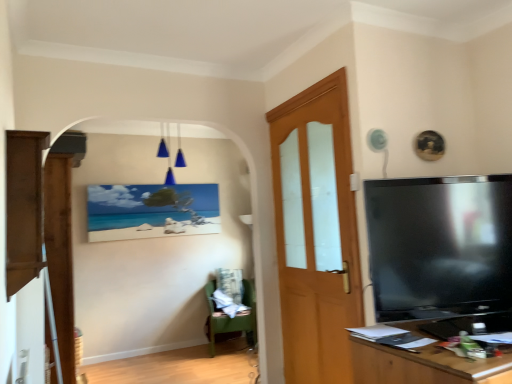
Question: From the image's perspective, would you say black glossy tv at right is positioned over brown wood cabinet at left?

Choices:
 (A) yes
 (B) no

Answer: (B)

Question: Is black glossy tv at right positioned with its back to brown wood cabinet at left?

Choices:
 (A) no
 (B) yes

Answer: (A)

Question: Is the depth of black glossy tv at right less than that of brown wood cabinet at left?

Choices:
 (A) yes
 (B) no

Answer: (B)

Question: Considering the relative sizes of black glossy tv at right and brown wood cabinet at left in the image provided, is black glossy tv at right bigger than brown wood cabinet at left?

Choices:
 (A) no
 (B) yes

Answer: (B)

Question: Can you confirm if black glossy tv at right is thinner than brown wood cabinet at left?

Choices:
 (A) yes
 (B) no

Answer: (B)

Question: Considering the relative positions of black glossy tv at right and brown wood cabinet at left in the image provided, is black glossy tv at right to the right of brown wood cabinet at left from the viewer's perspective?

Choices:
 (A) no
 (B) yes

Answer: (B)

Question: Is matte canvas painting at center not inside black glossy tv at right?

Choices:
 (A) no
 (B) yes

Answer: (B)

Question: Is matte canvas painting at center far from black glossy tv at right?

Choices:
 (A) no
 (B) yes

Answer: (B)

Question: Does matte canvas painting at center have a greater height compared to black glossy tv at right?

Choices:
 (A) yes
 (B) no

Answer: (B)

Question: Can you confirm if matte canvas painting at center is smaller than black glossy tv at right?

Choices:
 (A) no
 (B) yes

Answer: (B)

Question: Considering the relative positions of matte canvas painting at center and black glossy tv at right in the image provided, is matte canvas painting at center to the right of black glossy tv at right from the viewer's perspective?

Choices:
 (A) yes
 (B) no

Answer: (B)

Question: Can black glossy tv at right be found inside matte canvas painting at center?

Choices:
 (A) yes
 (B) no

Answer: (B)

Question: Is matte canvas painting at center to the left of blue glass light fixture at upper center from the viewer's perspective?

Choices:
 (A) yes
 (B) no

Answer: (A)